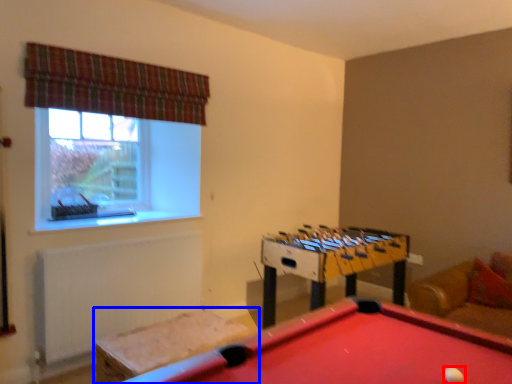
Question: Among these objects, which one is nearest to the camera, ball (highlighted by a red box) or furniture (highlighted by a blue box)?

Choices:
 (A) ball
 (B) furniture

Answer: (A)